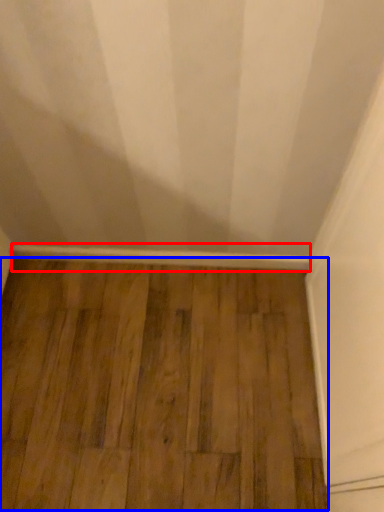
Question: Which point is closer to the camera, molding (highlighted by a red box) or hardwood (highlighted by a blue box)?

Choices:
 (A) molding
 (B) hardwood

Answer: (B)